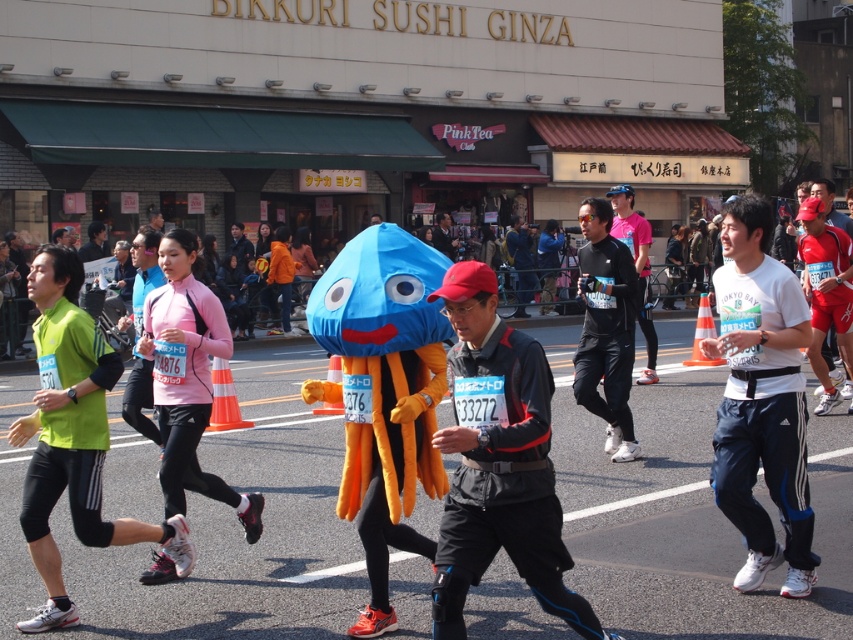
Question: Does white adidas track pants at center have a lesser width compared to black matte running suit at center?

Choices:
 (A) yes
 (B) no

Answer: (B)

Question: Based on their relative distances, which object is farther from the pink matte running suit at left?

Choices:
 (A) green fabric running outfit at left
 (B) white adidas track pants at center
 (C) dark gray/charcoal fabric jacket at center
 (D) black matte running suit at center

Answer: (D)

Question: Considering the relative positions of white adidas track pants at center and pink matte running suit at left in the image provided, where is white adidas track pants at center located with respect to pink matte running suit at left?

Choices:
 (A) right
 (B) left

Answer: (A)

Question: Which point is closer to the camera?

Choices:
 (A) green fabric running outfit at left
 (B) white adidas track pants at center

Answer: (A)

Question: Among these points, which one is nearest to the camera?

Choices:
 (A) (166, 404)
 (B) (730, 413)

Answer: (B)

Question: Does white adidas track pants at center have a greater width compared to green fabric running outfit at left?

Choices:
 (A) yes
 (B) no

Answer: (B)